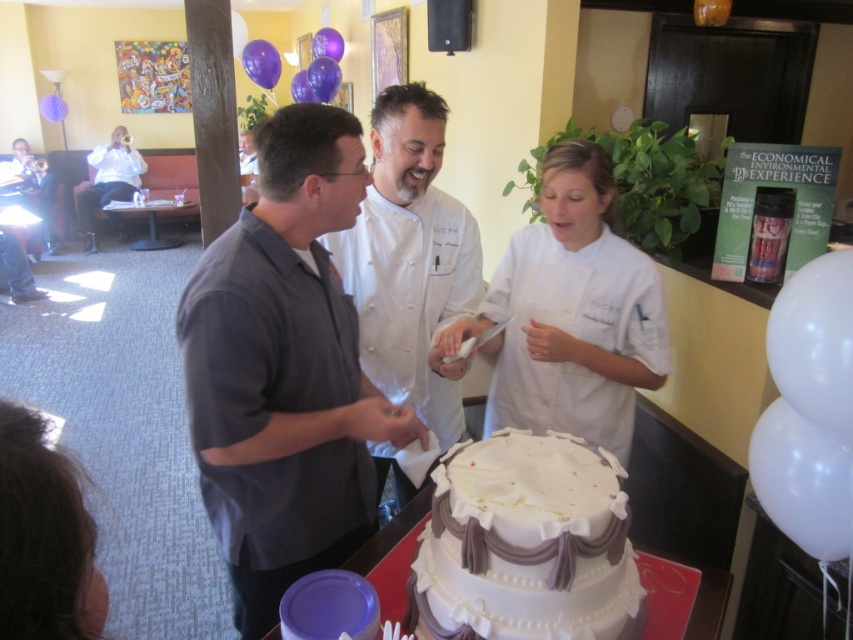
Question: Is white matte chef coat at center wider than white chef coat at center?

Choices:
 (A) no
 (B) yes

Answer: (B)

Question: Considering the relative positions of white fondant cake at center and white chef coat at center in the image provided, where is white fondant cake at center located with respect to white chef coat at center?

Choices:
 (A) right
 (B) left

Answer: (A)

Question: Among these points, which one is farthest from the camera?

Choices:
 (A) (434, 102)
 (B) (596, 372)
 (C) (392, 333)
 (D) (511, 538)

Answer: (C)

Question: Which object is closer to the camera taking this photo?

Choices:
 (A) white matte chef coat at center
 (B) white chef coat at center
 (C) white smooth chef coat at center
 (D) white fondant cake at center

Answer: (D)

Question: Does dark gray shirt at center appear over white matte chef coat at center?

Choices:
 (A) yes
 (B) no

Answer: (B)

Question: Based on their relative distances, which object is nearer to the white fondant cake at center?

Choices:
 (A) white chef coat at center
 (B) white matte chef coat at center

Answer: (B)